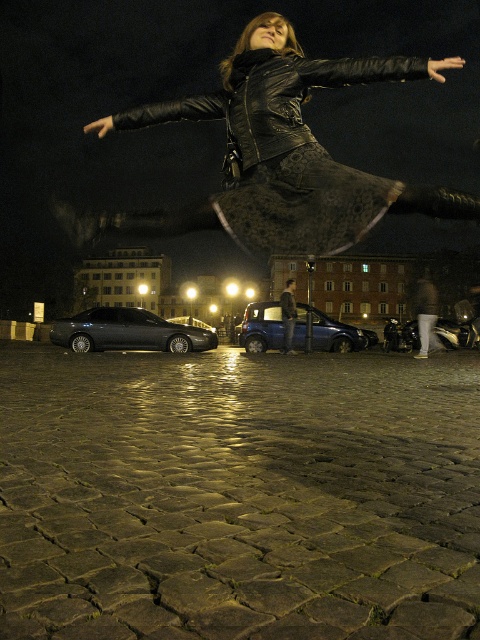
You are a delivery person who needs to park your 2.5 meter wide van in this area. Looking at the dark stone paving at center and the blue metallic car at center, which location would allow your van to fit without overlapping other objects?

The dark stone paving at center has a larger width than the blue metallic car at center, so the van can fit on the dark stone paving at center.

You are standing on the cobblestone street in the image and see the point at coordinates (238, 497). Where is this point located?

The point at coordinates (238, 497) is located on the dark stone paving at center.